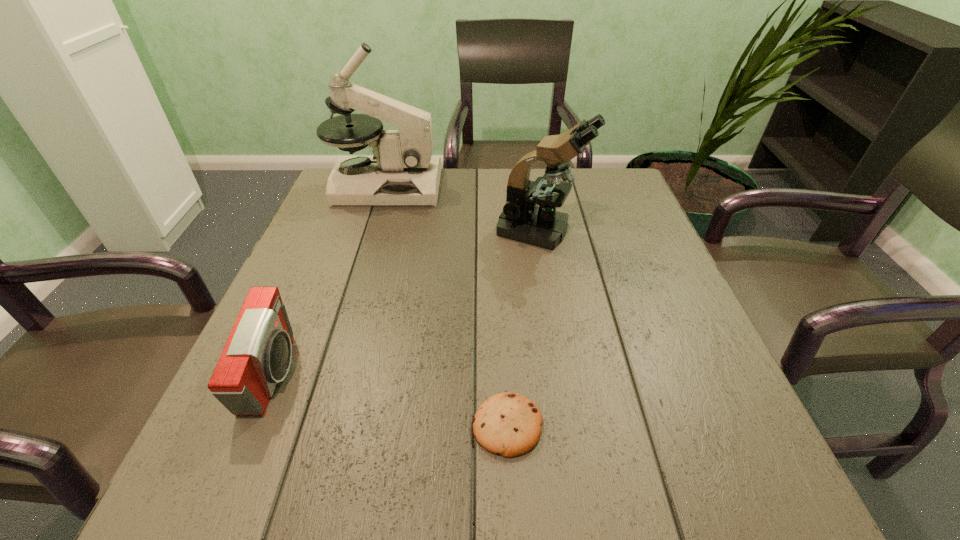
Image resolution: width=960 pixels, height=540 pixels. Identify the location of vacant area between the farther microscope and the right microscope. (463, 208).

Where is `empty location between the camera and the shorter microscope`? This screenshot has width=960, height=540. empty location between the camera and the shorter microscope is located at coordinates (407, 302).

The image size is (960, 540). I want to click on free space between the shorter microscope and the shortest object, so click(523, 328).

Locate an element on the screen. free space between the cookie and the farther microscope is located at coordinates (446, 306).

Where is `empty space between the shorter microscope and the third tallest object`? This screenshot has width=960, height=540. empty space between the shorter microscope and the third tallest object is located at coordinates (407, 302).

In order to click on vacant point located between the third tallest object and the cookie in this screenshot , I will do `click(391, 400)`.

Identify the location of free area in between the shortest object and the farthest object. Image resolution: width=960 pixels, height=540 pixels. (446, 306).

Find the location of a particular element. This screenshot has width=960, height=540. free space between the second tallest object and the camera is located at coordinates (407, 302).

The image size is (960, 540). I want to click on free space that is in between the third tallest object and the third nearest object, so click(x=407, y=302).

The height and width of the screenshot is (540, 960). Identify the location of vacant region between the farther microscope and the cookie. (446, 306).